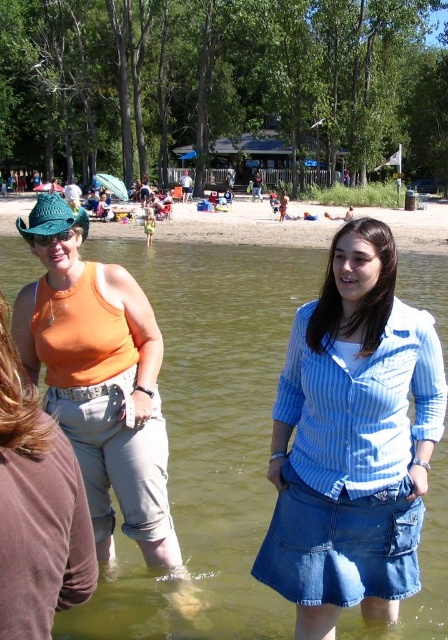
Is orange matte tank top at left positioned at the back of orange matte tank top at upper left?

Yes, it is.

Which is above, orange matte tank top at left or orange matte tank top at upper left?

orange matte tank top at upper left is above.

Locate an element on the screen. This screenshot has width=448, height=640. orange matte tank top at left is located at coordinates (102, 385).

You are a GUI agent. You are given a task and a screenshot of the screen. Output one action in this format:
    pyautogui.click(x=<x>, y=<y>)
    Task: Click on the orange matte tank top at left
    
    Given the screenshot: What is the action you would take?
    pyautogui.click(x=102, y=385)

Which is behind, point (434, 636) or point (60, 490)?

Positioned behind is point (434, 636).

Can you confirm if greenish water at center is taller than orange matte tank top at upper left?

Yes, greenish water at center is taller than orange matte tank top at upper left.

What do you see at coordinates (207, 436) in the screenshot? I see `greenish water at center` at bounding box center [207, 436].

Locate an element on the screen. greenish water at center is located at coordinates (207, 436).

Which is above, blue striped shirt at center or orange matte tank top at upper left?

orange matte tank top at upper left is above.

Which is in front, point (365, 344) or point (29, 388)?

Point (29, 388)

Locate an element on the screen. Image resolution: width=448 pixels, height=640 pixels. blue striped shirt at center is located at coordinates (353, 440).